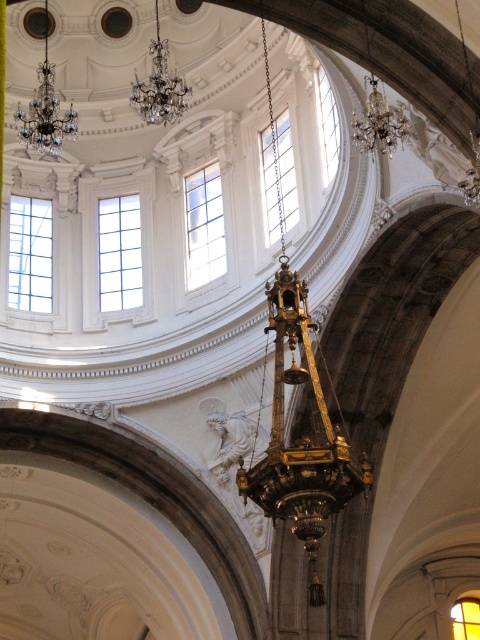
You are an interior designer planning to install a new lighting system in the cathedral. You need to ensure that two existing crystal glass chandeliers are spaced appropriately for safety and aesthetic balance. Given that the distance between the crystal glass chandelier at upper center and the crystal glass chandelier at upper right is 9.39 meters, is this spacing considered sufficient for proper installation standards?

The distance between the crystal glass chandelier at upper center and the crystal glass chandelier at upper right is 9.39 meters, which meets standard spacing requirements for safety and aesthetic balance in such large spaces.

In the scene shown: You are standing in the grand building and want to take a photo of both crystal glass chandelier at upper center and crystal glass chandelier at upper right. Which chandelier should you focus on first to ensure both are in frame?

You should focus on the crystal glass chandelier at upper center first because it is closer to you than the crystal glass chandelier at upper right, so adjusting the camera to include both would require framing starting from the closer one.

You are standing in the center of the cathedral and want to look up at the crystal glass chandelier at upper left. In which direction should you turn your head to see it?

The crystal glass chandelier at upper left is located at point (46, 109), so you should turn your head to the upper left to see it.